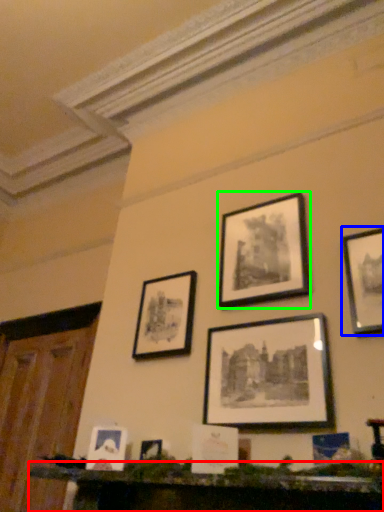
Question: Which object is the farthest from furniture (highlighted by a red box)? Choose among these: picture frame (highlighted by a blue box) or picture frame (highlighted by a green box).

Choices:
 (A) picture frame
 (B) picture frame

Answer: (B)